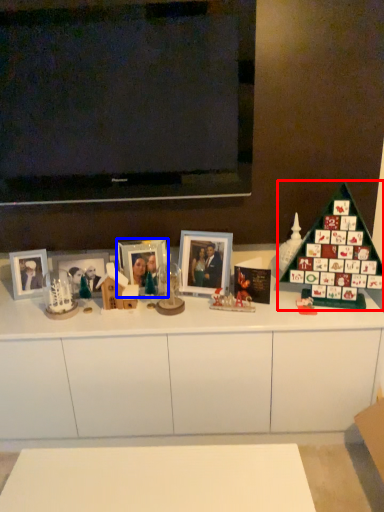
Question: Which object is further to the camera taking this photo, christmas tree (highlighted by a red box) or picture frame (highlighted by a blue box)?

Choices:
 (A) christmas tree
 (B) picture frame

Answer: (B)